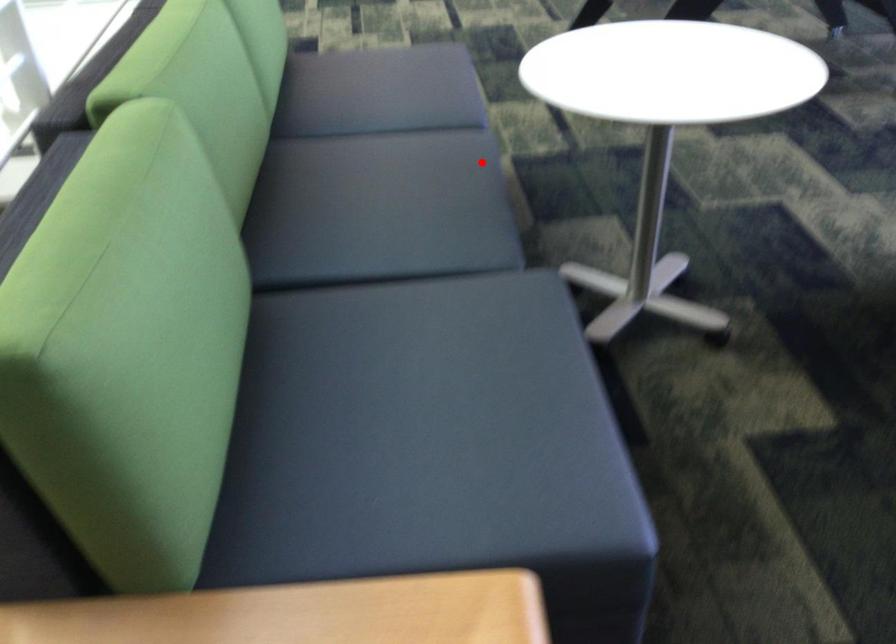
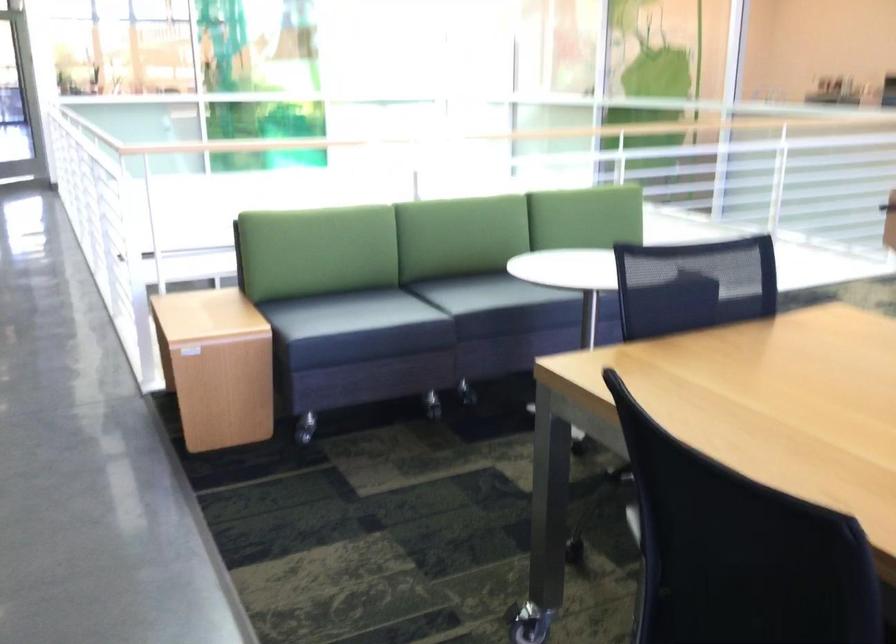
The point at the highlighted location is marked in the first image. Where is the corresponding point in the second image?

(488, 292)